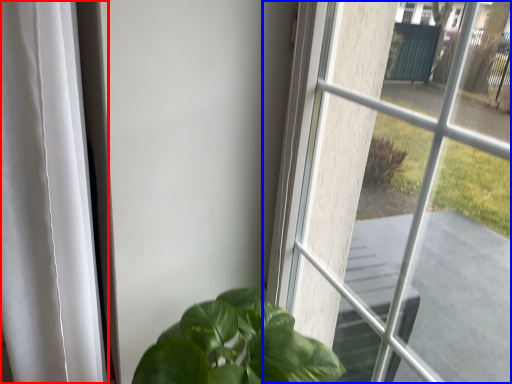
Question: Which point is further to the camera, curtain (highlighted by a red box) or window (highlighted by a blue box)?

Choices:
 (A) curtain
 (B) window

Answer: (A)